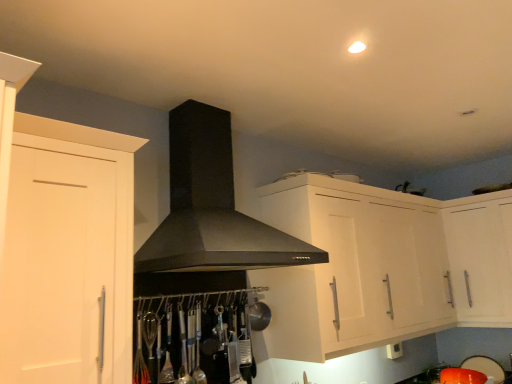
Question: From their relative heights in the image, would you say black matte fume hood at center is taller or shorter than orange matte bowl at lower right, placed as the 1th appliance when sorted from left to right?

Choices:
 (A) short
 (B) tall

Answer: (B)

Question: Considering their positions, is black matte fume hood at center located in front of or behind orange matte bowl at lower right, placed as the 1th appliance when sorted from left to right?

Choices:
 (A) behind
 (B) front

Answer: (B)

Question: Estimate the real-world distances between objects in this image. Which object is closer to the white glossy cabinet at upper right, the 2th cabinetry in the left-to-right sequence?

Choices:
 (A) orange plastic bowl at lower right, the 1th appliance in the right-to-left sequence
 (B) white matte cabinet at left, which is the first cabinetry in left-to-right order
 (C) black matte fume hood at center
 (D) orange matte bowl at lower right, which ranks as the second appliance in right-to-left order

Answer: (C)

Question: Estimate the real-world distances between objects in this image. Which object is closer to the orange matte bowl at lower right, which ranks as the second appliance in right-to-left order?

Choices:
 (A) orange plastic bowl at lower right, the 1th appliance in the right-to-left sequence
 (B) white glossy cabinet at upper right, which is the first cabinetry in back-to-front order
 (C) black matte fume hood at center
 (D) white matte cabinet at left, which is the first cabinetry in left-to-right order

Answer: (A)